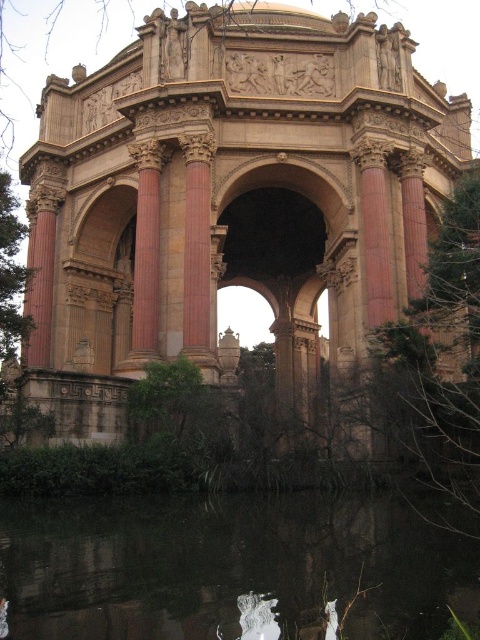
Can you confirm if beige stone palace at center is positioned to the right of smooth pink stone column at center?

Correct, you'll find beige stone palace at center to the right of smooth pink stone column at center.

Who is positioned more to the right, beige stone palace at center or smooth pink stone column at center?

beige stone palace at center is more to the right.

Who is more distant from viewer, (109, 182) or (196, 355)?

Positioned behind is point (109, 182).

Where is `beige stone palace at center`? Image resolution: width=480 pixels, height=640 pixels. beige stone palace at center is located at coordinates (235, 192).

Between black reflective water at bottom and reddish-brown stone column at center-left, which one appears on the right side from the viewer's perspective?

black reflective water at bottom

Between black reflective water at bottom and reddish-brown stone column at center-left, which one has more height?

reddish-brown stone column at center-left is taller.

Identify the location of black reflective water at bottom. The width and height of the screenshot is (480, 640). (232, 568).

I want to click on black reflective water at bottom, so click(x=232, y=568).

Can you confirm if beige stone palace at center is bigger than reddish-brown stone column at center-left?

Correct, beige stone palace at center is larger in size than reddish-brown stone column at center-left.

Between point (335, 58) and point (139, 257), which one is positioned behind?

The point (335, 58) is behind.

Identify the location of beige stone palace at center. This screenshot has width=480, height=640. (235, 192).

This screenshot has height=640, width=480. Find the location of `beige stone palace at center`. beige stone palace at center is located at coordinates (235, 192).